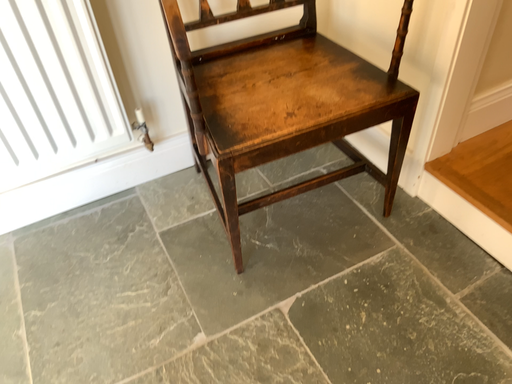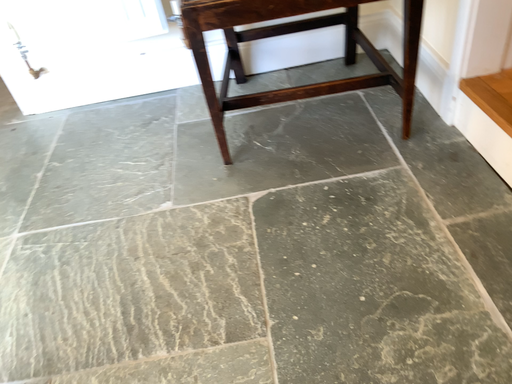
Question: How did the camera likely rotate when shooting the video?

Choices:
 (A) rotated right
 (B) rotated left

Answer: (B)